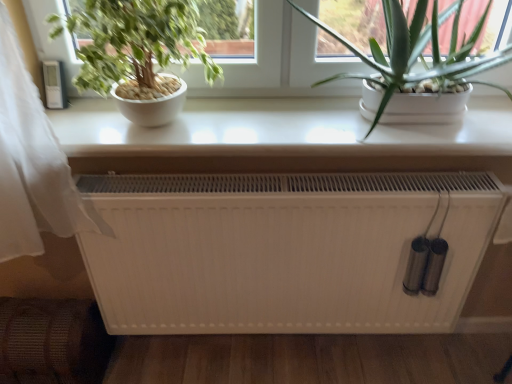
Question: Is white matte heater at center facing towards green leafy plant at upper right, which is the 2th houseplant from left to right?

Choices:
 (A) no
 (B) yes

Answer: (A)

Question: Is the position of white matte heater at center more distant than that of green leafy plant at upper right, acting as the first houseplant starting from the right?

Choices:
 (A) no
 (B) yes

Answer: (B)

Question: Does white matte heater at center have a lesser width compared to green leafy plant at upper right, which is the 2th houseplant from left to right?

Choices:
 (A) yes
 (B) no

Answer: (A)

Question: From the image's perspective, is white matte heater at center over green leafy plant at upper right, which is the 2th houseplant from left to right?

Choices:
 (A) yes
 (B) no

Answer: (B)

Question: Is white matte heater at center positioned before green leafy plant at upper right, which is the 2th houseplant from left to right?

Choices:
 (A) no
 (B) yes

Answer: (A)

Question: Is white glossy table at upper center in front of or behind green leafy plant at upper right, which is the 2th houseplant from left to right, in the image?

Choices:
 (A) front
 (B) behind

Answer: (B)

Question: From the image's perspective, is white glossy table at upper center positioned above or below green leafy plant at upper right, acting as the first houseplant starting from the right?

Choices:
 (A) below
 (B) above

Answer: (A)

Question: Is white glossy table at upper center wider or thinner than green leafy plant at upper right, which is the 2th houseplant from left to right?

Choices:
 (A) thin
 (B) wide

Answer: (A)

Question: In terms of height, does white glossy table at upper center look taller or shorter compared to green leafy plant at upper right, acting as the first houseplant starting from the right?

Choices:
 (A) short
 (B) tall

Answer: (A)

Question: Looking at their shapes, would you say green leafy plant at upper left is wider or thinner than green leafy plant at upper right, acting as the first houseplant starting from the right?

Choices:
 (A) thin
 (B) wide

Answer: (A)

Question: From a real-world perspective, is green leafy plant at upper left above or below green leafy plant at upper right, acting as the first houseplant starting from the right?

Choices:
 (A) above
 (B) below

Answer: (B)

Question: Relative to green leafy plant at upper right, acting as the first houseplant starting from the right, is green leafy plant at upper left in front or behind?

Choices:
 (A) behind
 (B) front

Answer: (A)

Question: Looking at the image, does green leafy plant at upper left seem bigger or smaller compared to green leafy plant at upper right, which is the 2th houseplant from left to right?

Choices:
 (A) big
 (B) small

Answer: (B)

Question: From a real-world perspective, is green matte plant at left, which appears as the first houseplant when viewed from the left, physically located above or below green leafy plant at upper left?

Choices:
 (A) above
 (B) below

Answer: (A)

Question: Looking at their shapes, would you say green matte plant at left, which appears as the first houseplant when viewed from the left, is wider or thinner than green leafy plant at upper left?

Choices:
 (A) thin
 (B) wide

Answer: (B)